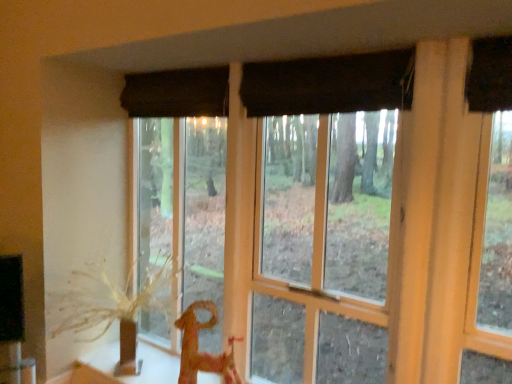
Where is `black fabric curtain at upper center`? The width and height of the screenshot is (512, 384). black fabric curtain at upper center is located at coordinates tap(329, 84).

Locate an element on the screen. The height and width of the screenshot is (384, 512). black fabric curtain at upper center is located at coordinates (329, 84).

Do you think wooden horse at lower center is within black fabric curtain at upper center, or outside of it?

wooden horse at lower center is spatially situated outside black fabric curtain at upper center.

Locate an element on the screen. animal that appears below the black fabric curtain at upper center (from the image's perspective) is located at coordinates (198, 347).

Which is nearer, (196, 346) or (206, 95)?

Point (196, 346) is positioned closer to the camera compared to point (206, 95).

Which object is further away from the camera taking this photo, wooden horse at lower center or black fabric curtain at upper center?

wooden horse at lower center.

Is point (389, 242) closer to viewer compared to point (187, 332)?

Yes, point (389, 242) is in front of point (187, 332).

Considering their positions, is matte brown curtain at center located in front of or behind wooden horse at lower center?

In the image, matte brown curtain at center appears in front of wooden horse at lower center.

Which is correct: matte brown curtain at center is inside wooden horse at lower center, or outside of it?

matte brown curtain at center lies outside wooden horse at lower center.

Does matte brown curtain at center have a greater height compared to wooden horse at lower center?

Yes.

Would you say wooden horse at lower center is outside matte brown curtain at center?

wooden horse at lower center lies outside matte brown curtain at center's area.

Is wooden horse at lower center oriented away from matte brown curtain at center?

Yes, matte brown curtain at center is at the back of wooden horse at lower center.

From the image's perspective, which is above, wooden horse at lower center or matte brown curtain at center?

From the image's view, matte brown curtain at center is above.

Locate an element on the screen. animal that is below the matte brown curtain at center (from the image's perspective) is located at coordinates (198, 347).

Find the location of `curtain that is above the brown textured plant at left (from a real-world perspective)`. curtain that is above the brown textured plant at left (from a real-world perspective) is located at coordinates (329, 84).

From a real-world perspective, is black fabric curtain at upper center under brown textured plant at left?

No.

Consider the image. How distant is black fabric curtain at upper center from brown textured plant at left?

The distance of black fabric curtain at upper center from brown textured plant at left is 1.29 meters.

Consider the image. Does black fabric curtain at upper center have a greater width compared to brown textured plant at left?

No.

Can you confirm if black fabric curtain at upper center is positioned to the right of wooden horse at lower center?

Yes, black fabric curtain at upper center is to the right of wooden horse at lower center.

Between point (394, 74) and point (230, 371), which one is positioned behind?

Positioned behind is point (230, 371).

From the image's perspective, relative to wooden horse at lower center, is black fabric curtain at upper center above or below?

From the image's perspective, black fabric curtain at upper center appears above wooden horse at lower center.

Considering the relative sizes of black fabric curtain at upper center and wooden horse at lower center in the image provided, is black fabric curtain at upper center smaller than wooden horse at lower center?

Indeed, black fabric curtain at upper center has a smaller size compared to wooden horse at lower center.

Which of these two, brown textured plant at left or matte brown curtain at center, is bigger?

Bigger between the two is matte brown curtain at center.

Is brown textured plant at left far from matte brown curtain at center?

Yes.

From the image's perspective, is brown textured plant at left below matte brown curtain at center?

Correct, brown textured plant at left appears lower than matte brown curtain at center in the image.

Considering the points (71, 329) and (373, 185), which point is behind, point (71, 329) or point (373, 185)?

The point (373, 185) is more distant.

Is wooden horse at lower center not close to brown textured plant at left?

wooden horse at lower center is near brown textured plant at left, not far away.

Could you tell me if wooden horse at lower center is facing brown textured plant at left?

No, wooden horse at lower center is not turned towards brown textured plant at left.

Considering the relative positions of wooden horse at lower center and brown textured plant at left in the image provided, is wooden horse at lower center to the right of brown textured plant at left from the viewer's perspective?

Indeed, wooden horse at lower center is positioned on the right side of brown textured plant at left.

Does wooden horse at lower center have a smaller size compared to brown textured plant at left?

Yes.

This screenshot has height=384, width=512. There is a wooden horse at lower center. Identify the location of curtain above it (from a real-world perspective). (329, 84).

You are a GUI agent. You are given a task and a screenshot of the screen. Output one action in this format:
    pyautogui.click(x=<x>, y=<y>)
    Task: Click on the window that appears above the wooden horse at lower center (from the image's perspective)
    Image resolution: width=512 pixels, height=384 pixels.
    Given the screenshot: What is the action you would take?
    pyautogui.click(x=365, y=212)

Estimate the real-world distances between objects in this image. Which object is further from black fabric curtain at upper center, wooden horse at lower center or matte brown curtain at center?

Based on the image, wooden horse at lower center appears to be further to black fabric curtain at upper center.

Looking at the image, which one is located further to wooden horse at lower center, brown textured plant at left or black fabric curtain at upper center?

black fabric curtain at upper center.

Based on the photo, looking at the image, which one is located closer to brown textured plant at left, black fabric curtain at upper center or wooden horse at lower center?

The object closer to brown textured plant at left is wooden horse at lower center.

Looking at the image, which one is located further to black fabric curtain at upper center, brown textured plant at left or wooden horse at lower center?

Based on the image, brown textured plant at left appears to be further to black fabric curtain at upper center.

Looking at the image, which one is located further to wooden horse at lower center, matte brown curtain at center or black fabric curtain at upper center?

black fabric curtain at upper center.

Considering their positions, is matte brown curtain at center positioned closer to brown textured plant at left than black fabric curtain at upper center?

matte brown curtain at center is positioned closer to the anchor brown textured plant at left.

Looking at the image, which one is located further to matte brown curtain at center, wooden horse at lower center or black fabric curtain at upper center?

The object further to matte brown curtain at center is wooden horse at lower center.

Which object lies further to the anchor point black fabric curtain at upper center, wooden horse at lower center or brown textured plant at left?

brown textured plant at left is positioned further to the anchor black fabric curtain at upper center.

This screenshot has height=384, width=512. What are the coordinates of `plant between black fabric curtain at upper center and wooden horse at lower center in the vertical direction` in the screenshot? It's located at (114, 299).

Find the location of a particular element. Image resolution: width=512 pixels, height=384 pixels. animal located between brown textured plant at left and matte brown curtain at center in the left-right direction is located at coordinates (198, 347).

Locate an element on the screen. This screenshot has height=384, width=512. window between black fabric curtain at upper center and brown textured plant at left in the up-down direction is located at coordinates (365, 212).

This screenshot has width=512, height=384. What are the coordinates of `window between black fabric curtain at upper center and wooden horse at lower center in the up-down direction` in the screenshot? It's located at (365, 212).